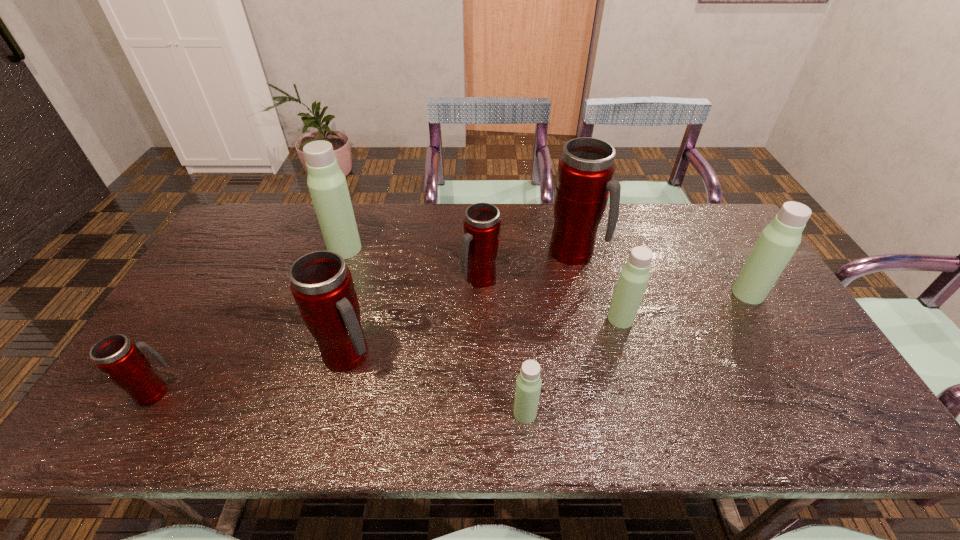
Find the location of a particular element. The height and width of the screenshot is (540, 960). vacant space that satisfies the following two spatial constraints: 1. on the side with the handle of the biggest red thermos bottle; 2. on the side with the handle of the fourth object from left to right is located at coordinates (581, 279).

Find the location of a particular element. The height and width of the screenshot is (540, 960). vacant position in the image that satisfies the following two spatial constraints: 1. on the side with the handle of the biggest red thermos bottle; 2. on the side with the handle of the fifth object from right to left is located at coordinates (581, 279).

At what (x,y) coordinates should I click in order to perform the action: click on free region that satisfies the following two spatial constraints: 1. on the side with the handle of the rightmost thermos bottle; 2. on the left side of the fifth thermos bottle from right to left. Please return your answer as a coordinate pair (x, y). Looking at the image, I should click on (481, 294).

Where is `vacant space that satisfies the following two spatial constraints: 1. on the side with the handle of the fourth thermos bottle from left to right; 2. on the left side of the rightmost thermos bottle`? vacant space that satisfies the following two spatial constraints: 1. on the side with the handle of the fourth thermos bottle from left to right; 2. on the left side of the rightmost thermos bottle is located at coordinates (481, 294).